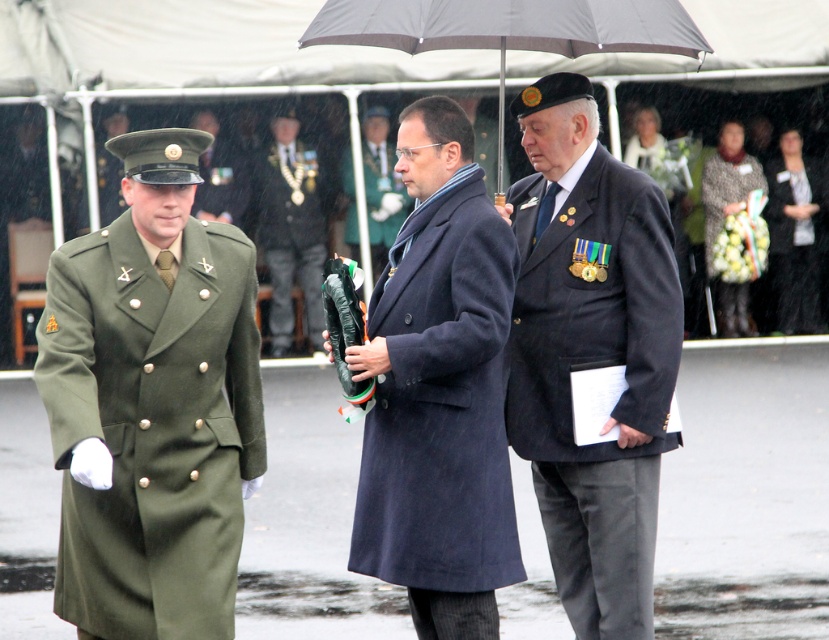
Does gray matte umbrella at center appear on the right side of matte green coat at center?

Correct, you'll find gray matte umbrella at center to the right of matte green coat at center.

Looking at this image, is gray matte umbrella at center thinner than matte green coat at center?

In fact, gray matte umbrella at center might be wider than matte green coat at center.

What do you see at coordinates (508, 29) in the screenshot? The width and height of the screenshot is (829, 640). I see `gray matte umbrella at center` at bounding box center [508, 29].

This screenshot has width=829, height=640. Find the location of `gray matte umbrella at center`. gray matte umbrella at center is located at coordinates (508, 29).

Does point (784, 244) come in front of point (377, 234)?

No.

The height and width of the screenshot is (640, 829). Identify the location of black fabric coat at right. (793, 244).

Is navy wool coat at center shorter than matte green coat at center?

No, navy wool coat at center is not shorter than matte green coat at center.

Does point (459, 476) come behind point (377, 177)?

No, (459, 476) is closer to viewer.

Who is more distant from viewer, (449, 444) or (394, 161)?

The point (394, 161) is behind.

At what (x,y) coordinates should I click in order to perform the action: click on navy wool coat at center. Please return your answer as a coordinate pair (x, y). This screenshot has height=640, width=829. Looking at the image, I should click on (439, 390).